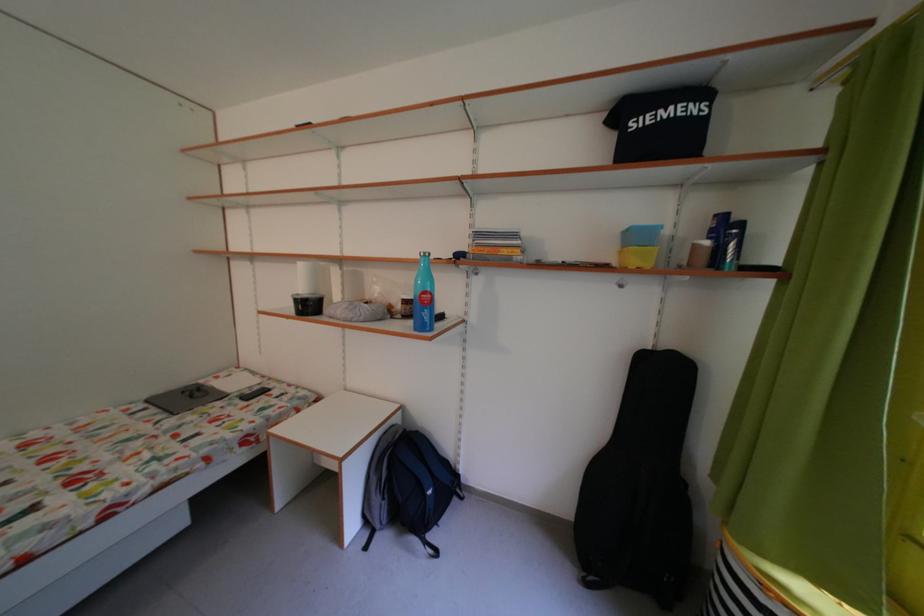
Find where to lift the yellow plastic bin. Please return your answer as a coordinate pair (x, y).

(638, 257)